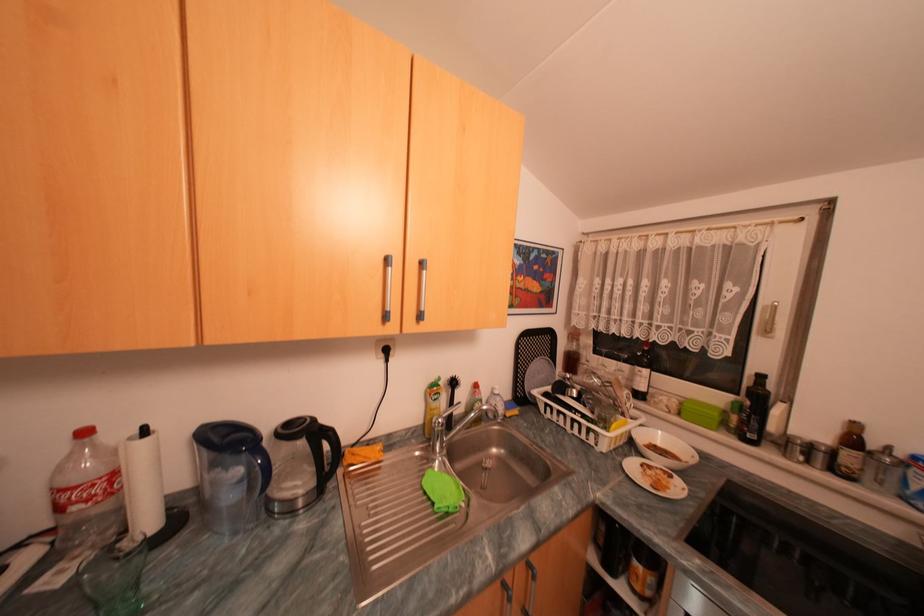
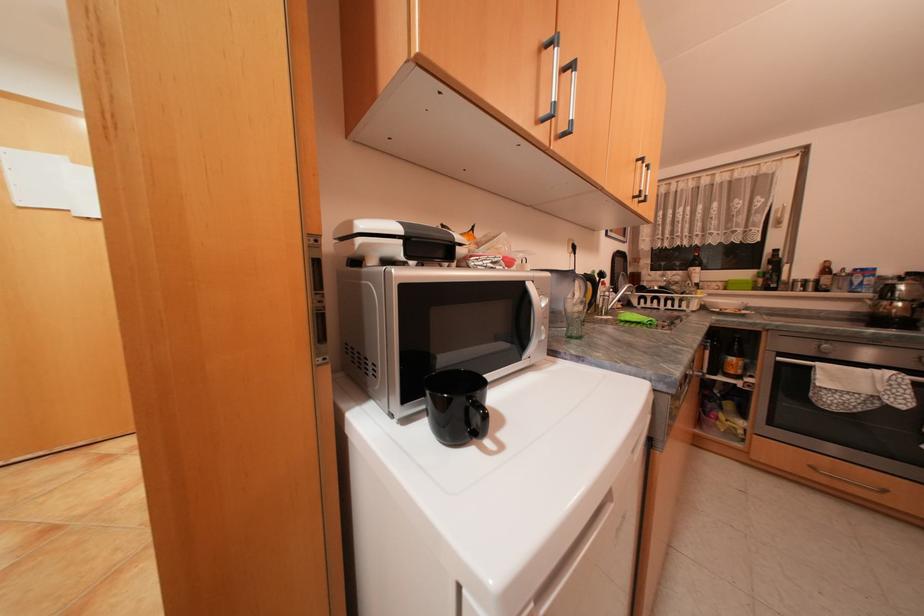
Question: Which direction would the cameraman need to move to produce the second image? Reply with the corresponding letter.

Choices:
 (A) Left
 (B) Right
 (C) Forward
 (D) Backward

Answer: (A)